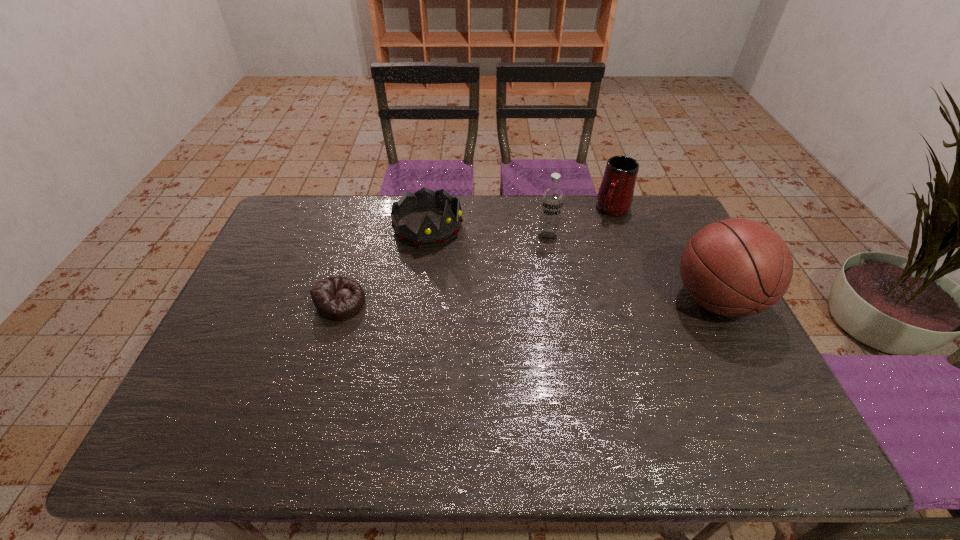
Locate an element on the screen. The width and height of the screenshot is (960, 540). beanbag is located at coordinates (338, 298).

Find the location of a particular element. This screenshot has height=540, width=960. the shortest object is located at coordinates (338, 298).

Find the location of a particular element. Image resolution: width=960 pixels, height=540 pixels. basketball is located at coordinates (734, 267).

This screenshot has width=960, height=540. What are the coordinates of `the fourth object from right to left` in the screenshot? It's located at (428, 235).

This screenshot has width=960, height=540. In order to click on vodka in this screenshot , I will do `click(552, 199)`.

Where is `mug`? This screenshot has height=540, width=960. mug is located at coordinates (615, 195).

Locate an element on the screen. vacant space located on the right of the leftmost object is located at coordinates pos(404,302).

You are a GUI agent. You are given a task and a screenshot of the screen. Output one action in this format:
    pyautogui.click(x=<x>, y=<y>)
    Task: Click on the vacant area situated on the back of the basketball
    
    Given the screenshot: What is the action you would take?
    pyautogui.click(x=674, y=219)

In order to click on free space located 0.110m at the front of the tiara with jewels in this screenshot , I will do `click(475, 260)`.

Identify the location of vacant space situated at the front of the tiara with jewels. This screenshot has width=960, height=540. (516, 289).